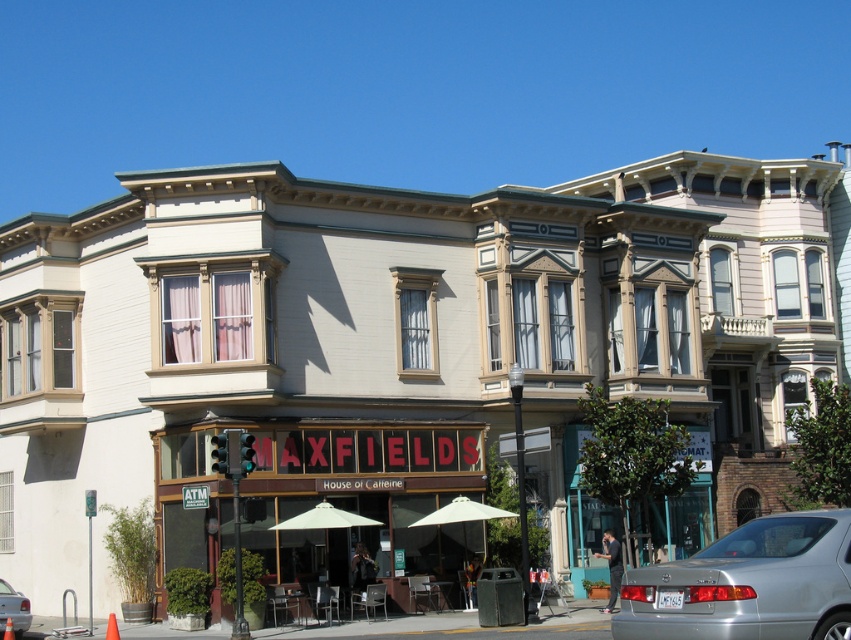
Question: Estimate the real-world distances between objects in this image. Which object is farther from the silver metallic sedan at lower left?

Choices:
 (A) silver metallic sedan at lower right
 (B) matte red sign at center

Answer: (A)

Question: Does matte red sign at center appear on the left side of silver metallic sedan at lower right?

Choices:
 (A) yes
 (B) no

Answer: (A)

Question: Which object is closer to the camera taking this photo?

Choices:
 (A) silver metallic sedan at lower right
 (B) matte red sign at center
 (C) silver metallic sedan at lower left

Answer: (A)

Question: Does matte red sign at center lie behind silver metallic sedan at lower right?

Choices:
 (A) yes
 (B) no

Answer: (A)

Question: Which point is farther from the camera taking this photo?

Choices:
 (A) (768, 637)
 (B) (403, 500)

Answer: (B)

Question: Is matte red sign at center further to the viewer compared to silver metallic sedan at lower right?

Choices:
 (A) yes
 (B) no

Answer: (A)